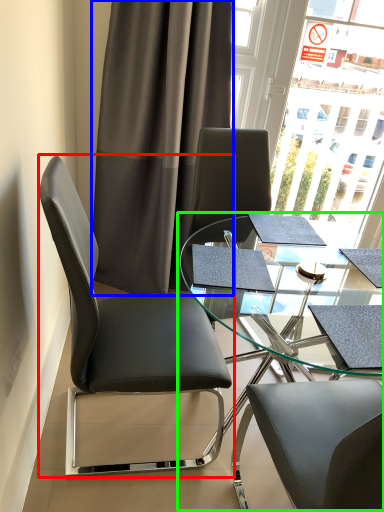
Question: Which object is the farthest from chair (highlighted by a red box)? Choose among these: curtain (highlighted by a blue box) or table (highlighted by a green box).

Choices:
 (A) curtain
 (B) table

Answer: (A)